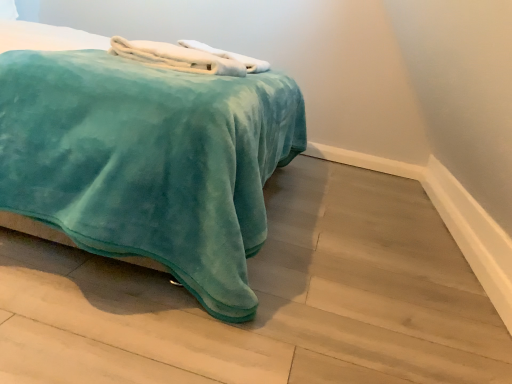
Question: Considering the positions of teal velvety bed at center and white soft towel at upper center, the first bath towel in the front-to-back sequence, in the image, is teal velvety bed at center bigger or smaller than white soft towel at upper center, the first bath towel in the front-to-back sequence,?

Choices:
 (A) small
 (B) big

Answer: (B)

Question: Is teal velvety bed at center taller or shorter than white soft towel at upper center, the 2th bath towel when ordered from back to front?

Choices:
 (A) tall
 (B) short

Answer: (A)

Question: Considering the real-world distances, which object is farthest from the white soft towel at upper center, the first bath towel in the front-to-back sequence?

Choices:
 (A) teal velvety bed at center
 (B) white fluffy bath towel at upper center, the second bath towel when ordered from front to back

Answer: (A)

Question: Which of these objects is positioned closest to the white fluffy bath towel at upper center, the second bath towel when ordered from front to back?

Choices:
 (A) teal velvety bed at center
 (B) white soft towel at upper center, the 2th bath towel when ordered from back to front

Answer: (B)